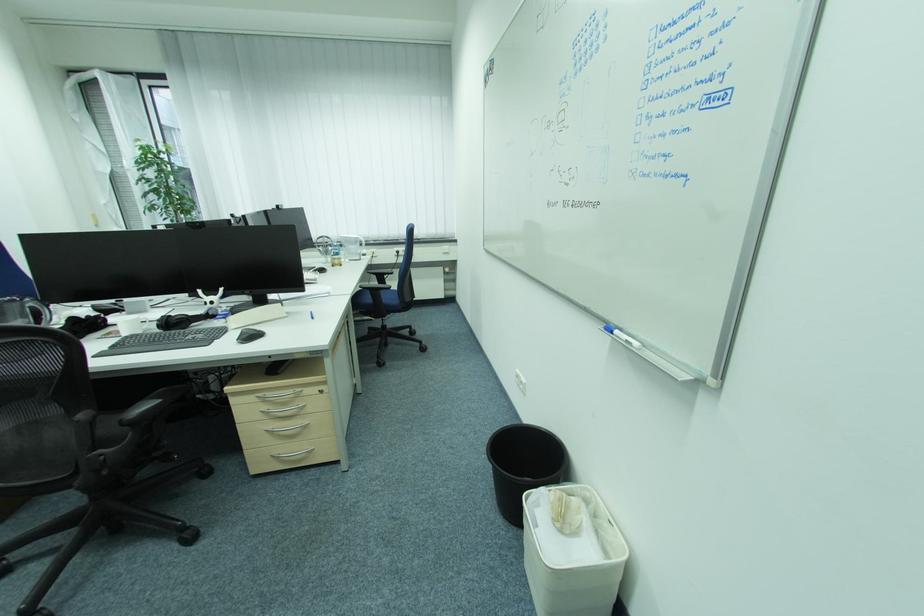
At what (x,y) coordinates should I click in order to perform the action: click on plastic water bottle. Please return your answer as a coordinate pair (x, y). The image size is (924, 616). Looking at the image, I should click on (335, 254).